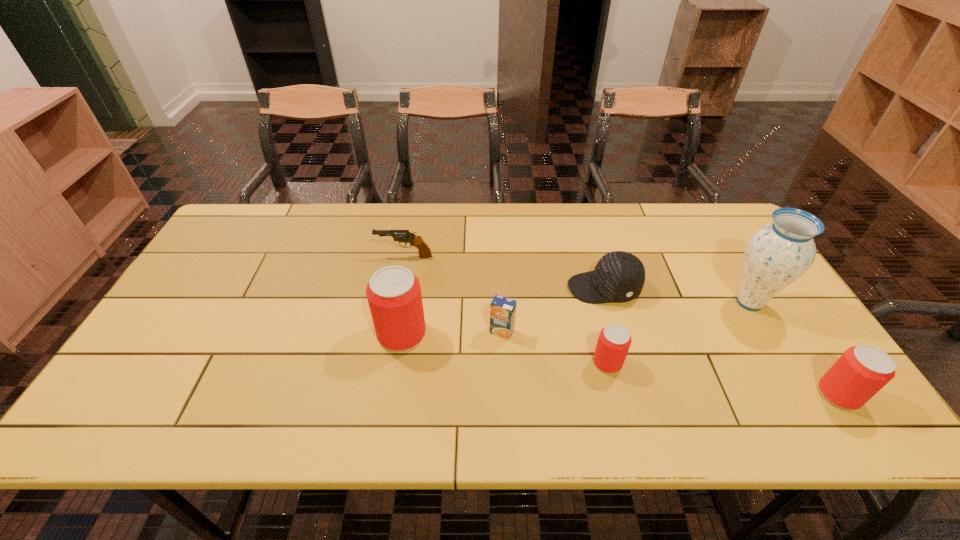
Locate an element on the screen. The image size is (960, 540). beer can present at the right edge is located at coordinates (863, 370).

Identify the location of vase that is positioned at the right edge. Image resolution: width=960 pixels, height=540 pixels. (777, 254).

The height and width of the screenshot is (540, 960). I want to click on object at the near right corner, so click(x=863, y=370).

The image size is (960, 540). In the image, there is a desktop. Find the location of `free space at the far edge`. free space at the far edge is located at coordinates (612, 220).

The image size is (960, 540). Identify the location of vacant space at the near edge. (756, 388).

Find the location of `free space at the far right corner`. free space at the far right corner is located at coordinates (678, 206).

The height and width of the screenshot is (540, 960). In order to click on free point between the orange_juice and the vase in this screenshot , I will do `click(626, 317)`.

This screenshot has height=540, width=960. I want to click on empty space between the nearest object and the second beer can from right to left, so click(723, 379).

The height and width of the screenshot is (540, 960). What are the coordinates of `unoccupied position between the baseball cap and the tallest object` in the screenshot? It's located at pos(677,295).

Where is `vacant area that lies between the third object from left to right and the second tallest object`? vacant area that lies between the third object from left to right and the second tallest object is located at coordinates point(452,333).